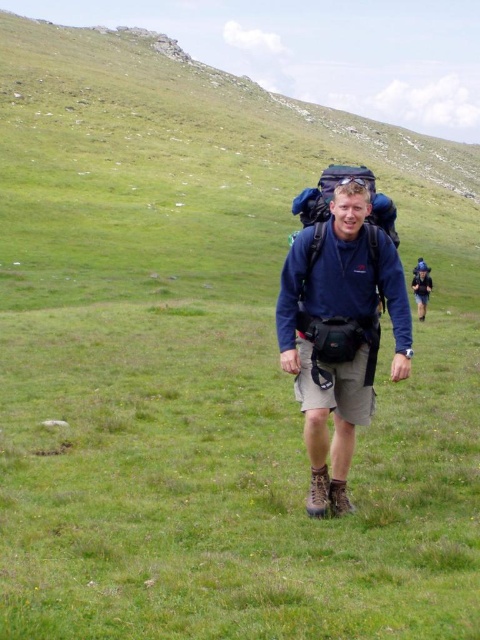
Is matte blue shirt at center below matte blue backpack at center?

Yes, matte blue shirt at center is below matte blue backpack at center.

Where is `matte blue shirt at center`? matte blue shirt at center is located at coordinates coord(338,332).